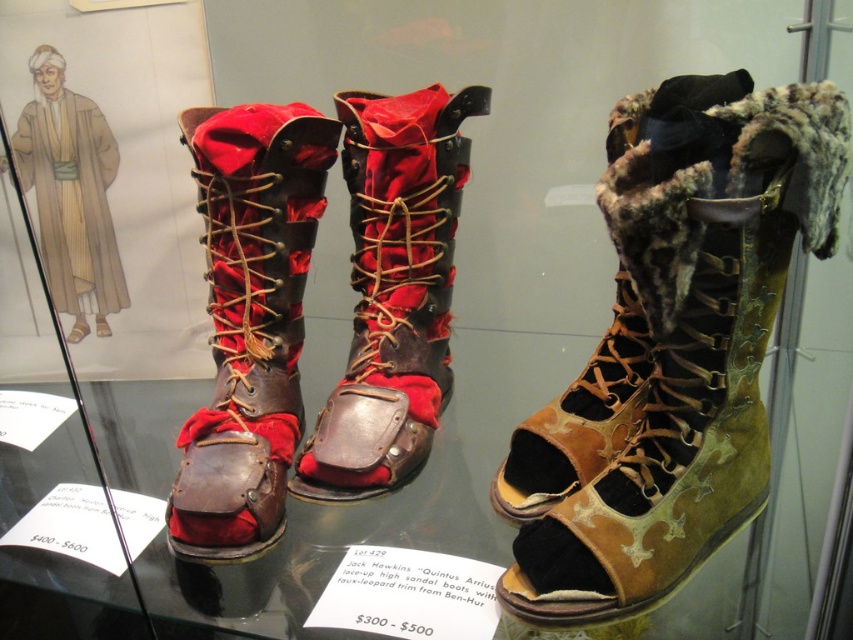
Is brown leather boot at center shorter than leather with fur trim sandal at right?

Incorrect, brown leather boot at center's height does not fall short of leather with fur trim sandal at right's.

Is brown leather boot at center smaller than leather with fur trim sandal at right?

Indeed, brown leather boot at center has a smaller size compared to leather with fur trim sandal at right.

What do you see at coordinates (248, 321) in the screenshot?
I see `brown leather boot at center` at bounding box center [248, 321].

Image resolution: width=853 pixels, height=640 pixels. Find the location of `brown leather boot at center`. brown leather boot at center is located at coordinates (x=248, y=321).

Is point (302, 492) positioned before point (581, 472)?

No, (302, 492) is behind (581, 472).

Is leather/red fabric boots at center taller than leather with fur trim sandal at right?

Yes, leather/red fabric boots at center is taller than leather with fur trim sandal at right.

Locate an element on the screen. The width and height of the screenshot is (853, 640). leather/red fabric boots at center is located at coordinates (393, 291).

Who is more forward, (225, 280) or (422, 237)?

Point (225, 280) is in front.

What do you see at coordinates (248, 321) in the screenshot? I see `brown leather boot at center` at bounding box center [248, 321].

Identify the location of brown leather boot at center. (248, 321).